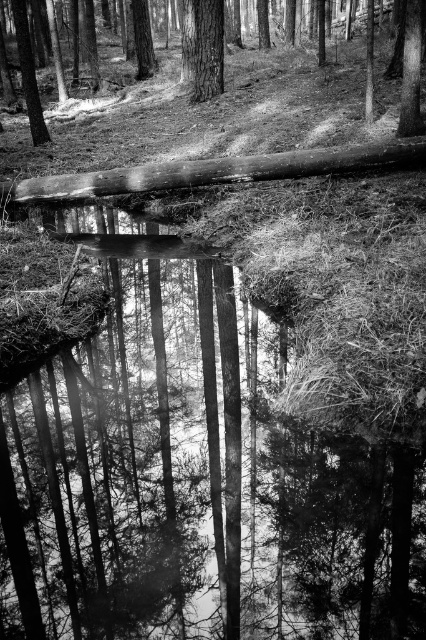
You are standing in the forest and see the smooth bark tree at upper center and the smooth wooden log at center. Which object is located higher up in the image?

The smooth bark tree at upper center is positioned over the smooth wooden log at center, so it is higher up in the image.

You are standing in the forest and see two trees. One is the smooth bark tree at center, and the other is the smooth bark tree at upper left. Which tree is located more to the right side of the other?

The smooth bark tree at center is positioned on the right side of the smooth bark tree at upper left, so the smooth bark tree at center is more to the right side of the smooth bark tree at upper left.